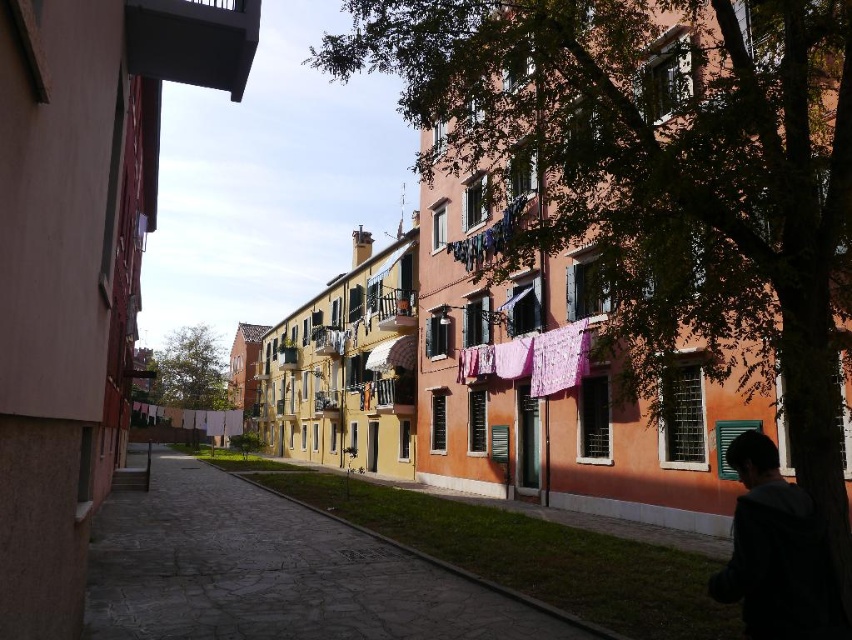
Can you confirm if paved stone alley at center is shorter than dark gray jacket at lower right?

No, paved stone alley at center is not shorter than dark gray jacket at lower right.

Can you confirm if paved stone alley at center is thinner than dark gray jacket at lower right?

Incorrect, paved stone alley at center's width is not less than dark gray jacket at lower right's.

This screenshot has width=852, height=640. What do you see at coordinates (281, 572) in the screenshot? I see `paved stone alley at center` at bounding box center [281, 572].

Where is `paved stone alley at center`? paved stone alley at center is located at coordinates point(281,572).

In the scene shown: Who is more distant from viewer, (x=324, y=628) or (x=453, y=253)?

The point (x=453, y=253) is more distant.

How much distance is there between paved stone alley at center and pink fabric clothesline at upper center?

paved stone alley at center and pink fabric clothesline at upper center are 8.03 meters apart from each other.

Does point (450, 596) come farther from viewer compared to point (471, 240)?

No, (450, 596) is in front of (471, 240).

Image resolution: width=852 pixels, height=640 pixels. Find the location of `paved stone alley at center`. paved stone alley at center is located at coordinates (281, 572).

Measure the distance between dark gray jacket at lower right and camera.

dark gray jacket at lower right is 2.55 meters away from camera.

Is dark gray jacket at lower right taller than pink fabric clothesline at upper center?

Incorrect, dark gray jacket at lower right's height is not larger of pink fabric clothesline at upper center's.

Who is more distant from viewer, (781, 586) or (486, 236)?

The point (486, 236) is behind.

You are a GUI agent. You are given a task and a screenshot of the screen. Output one action in this format:
    pyautogui.click(x=<x>, y=<y>)
    Task: Click on the dark gray jacket at lower right
    
    Given the screenshot: What is the action you would take?
    pyautogui.click(x=774, y=552)